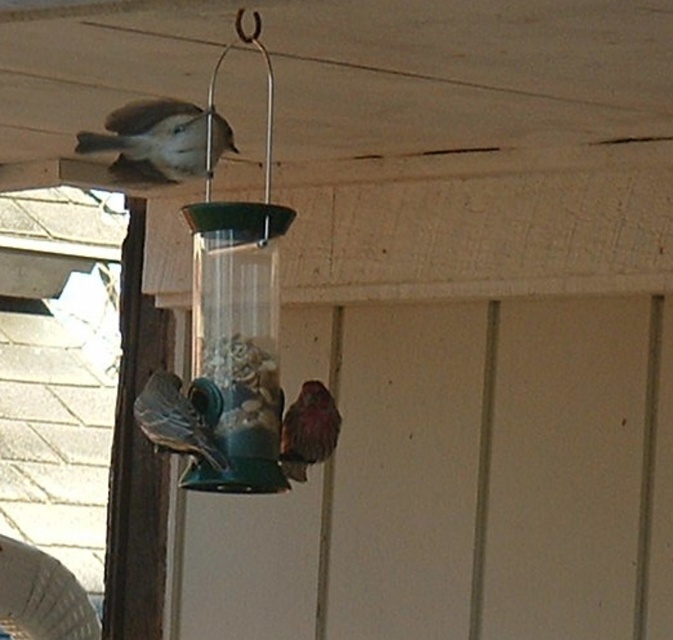
Question: Which of these objects is positioned closest to the brown speckled bird at upper left?

Choices:
 (A) brown speckled sparrow at center
 (B) blue-green metallic bird feeder at lower left

Answer: (B)

Question: Is brown speckled bird at upper left in front of blue-green metallic bird feeder at lower left?

Choices:
 (A) no
 (B) yes

Answer: (A)

Question: Does brown speckled bird at upper left come in front of blue-green metallic bird feeder at lower left?

Choices:
 (A) yes
 (B) no

Answer: (B)

Question: Does blue-green metallic bird feeder at lower left appear on the left side of brown speckled sparrow at center?

Choices:
 (A) no
 (B) yes

Answer: (B)

Question: Among these objects, which one is farthest from the camera?

Choices:
 (A) blue-green metallic bird feeder at lower left
 (B) brown speckled bird at upper left

Answer: (B)

Question: Which of the following is the closest to the observer?

Choices:
 (A) brown speckled bird at upper left
 (B) blue-green metallic bird feeder at lower left

Answer: (B)